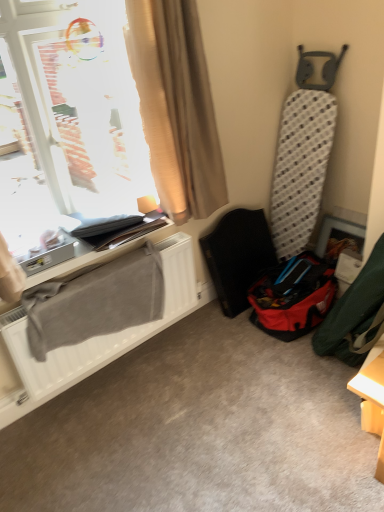
Question: Can we say plastic textured folding chair at center right lies outside red fabric bag at lower right?

Choices:
 (A) no
 (B) yes

Answer: (B)

Question: Considering the relative sizes of plastic textured folding chair at center right and red fabric bag at lower right in the image provided, is plastic textured folding chair at center right bigger than red fabric bag at lower right?

Choices:
 (A) no
 (B) yes

Answer: (B)

Question: Is plastic textured folding chair at center right far from red fabric bag at lower right?

Choices:
 (A) no
 (B) yes

Answer: (A)

Question: Is plastic textured folding chair at center right thinner than red fabric bag at lower right?

Choices:
 (A) no
 (B) yes

Answer: (B)

Question: Can you confirm if plastic textured folding chair at center right is wider than red fabric bag at lower right?

Choices:
 (A) yes
 (B) no

Answer: (B)

Question: Looking at the image, does plastic textured folding chair at center right seem bigger or smaller compared to beige fabric curtain at upper left?

Choices:
 (A) big
 (B) small

Answer: (A)

Question: From the image's perspective, is plastic textured folding chair at center right positioned above or below beige fabric curtain at upper left?

Choices:
 (A) below
 (B) above

Answer: (A)

Question: Is plastic textured folding chair at center right wider or thinner than beige fabric curtain at upper left?

Choices:
 (A) thin
 (B) wide

Answer: (B)

Question: Is plastic textured folding chair at center right to the left or to the right of beige fabric curtain at upper left in the image?

Choices:
 (A) left
 (B) right

Answer: (B)

Question: Which is correct: beige fabric curtain at upper left is inside plastic textured folding chair at center right, or outside of it?

Choices:
 (A) outside
 (B) inside

Answer: (A)

Question: From a real-world perspective, is beige fabric curtain at upper left positioned above or below plastic textured folding chair at center right?

Choices:
 (A) above
 (B) below

Answer: (A)

Question: Considering the positions of beige fabric curtain at upper left and plastic textured folding chair at center right in the image, is beige fabric curtain at upper left taller or shorter than plastic textured folding chair at center right?

Choices:
 (A) tall
 (B) short

Answer: (A)

Question: Is beige fabric curtain at upper left bigger or smaller than plastic textured folding chair at center right?

Choices:
 (A) big
 (B) small

Answer: (B)

Question: From a real-world perspective, is white matte radiator at lower left physically located above or below red fabric bag at lower right?

Choices:
 (A) below
 (B) above

Answer: (B)

Question: Is white matte radiator at lower left wider or thinner than red fabric bag at lower right?

Choices:
 (A) thin
 (B) wide

Answer: (A)